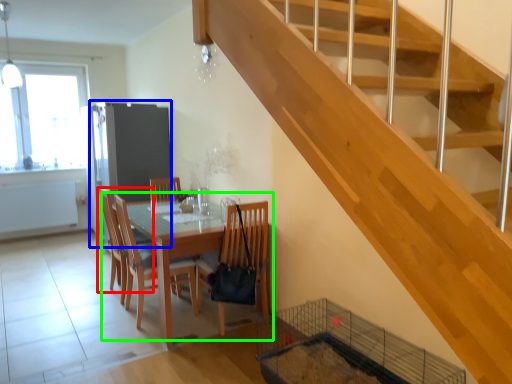
Question: Which object is the closest to the chair (highlighted by a red box)? Choose among these: screen door (highlighted by a blue box) or kitchen & dining room table (highlighted by a green box).

Choices:
 (A) screen door
 (B) kitchen & dining room table

Answer: (B)